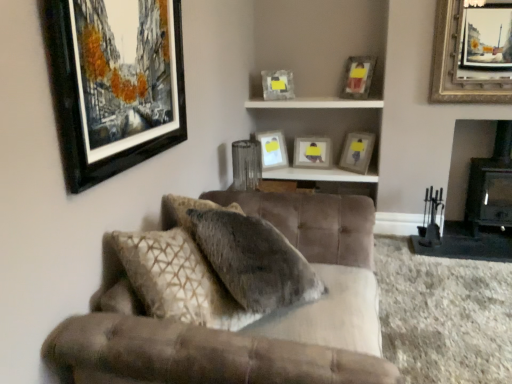
Measure the distance between matte gray picture frame at center, acting as the seventh picture frame starting from the front, and camera.

They are 3.82 meters apart.

Describe the element at coordinates (314, 103) in the screenshot. I see `white glossy shelf at upper center` at that location.

Measure the distance between white glossy shelf at upper center and camera.

The depth of white glossy shelf at upper center is 3.39 meters.

This screenshot has height=384, width=512. Describe the element at coordinates (357, 152) in the screenshot. I see `matte gray picture frame at upper right, which is the 4th picture frame in front-to-back order` at that location.

What do you see at coordinates (234, 309) in the screenshot?
I see `suede couch at center` at bounding box center [234, 309].

The image size is (512, 384). What do you see at coordinates (277, 84) in the screenshot? I see `matte glass picture frame at upper center, marked as the 3th picture frame in a left-to-right arrangement` at bounding box center [277, 84].

At what (x,y) coordinates should I click in order to perform the action: click on matte wooden picture frame at upper right, acting as the third picture frame starting from the front. Please return your answer as a coordinate pair (x, y). This screenshot has width=512, height=384. Looking at the image, I should click on (358, 77).

Measure the distance from matte gray picture frame at center, the 4th picture frame from the left, to black matte picture frame at upper left, arranged as the first picture frame when viewed from the front.

2.27 meters.

Is there a large distance between matte gray picture frame at center, the 4th picture frame from the left, and black matte picture frame at upper left, which is the seventh picture frame in right-to-left order?

Yes, matte gray picture frame at center, the 4th picture frame from the left, and black matte picture frame at upper left, which is the seventh picture frame in right-to-left order, are quite far apart.

What's the angular difference between matte gray picture frame at center, the 4th picture frame from the left, and black matte picture frame at upper left, which is the seventh picture frame in right-to-left order,'s facing directions?

The angle between the facing direction of matte gray picture frame at center, the 4th picture frame from the left, and the facing direction of black matte picture frame at upper left, which is the seventh picture frame in right-to-left order, is 93 degrees.

Between matte gray picture frame at center, the fourth picture frame viewed from the right, and black matte picture frame at upper left, arranged as the first picture frame when viewed from the front, which one has larger size?

black matte picture frame at upper left, arranged as the first picture frame when viewed from the front, is bigger.

Looking at the image, does matte wooden picture frame at upper right, the 3th picture frame in the right-to-left sequence, seem bigger or smaller compared to suede couch at center?

Clearly, matte wooden picture frame at upper right, the 3th picture frame in the right-to-left sequence, is smaller in size than suede couch at center.

Is point (345, 76) positioned after point (274, 350)?

Yes, it is behind point (274, 350).

Is matte wooden picture frame at upper right, acting as the third picture frame starting from the front, not inside suede couch at center?

Yes, matte wooden picture frame at upper right, acting as the third picture frame starting from the front, is located beyond the bounds of suede couch at center.

Considering the positions of objects white glossy shelf at upper center and wooden shelf at upper center in the image provided, who is more to the right, white glossy shelf at upper center or wooden shelf at upper center?

From the viewer's perspective, wooden shelf at upper center appears more on the right side.

From a real-world perspective, does white glossy shelf at upper center sit lower than wooden shelf at upper center?

No, from a real-world perspective, white glossy shelf at upper center is not below wooden shelf at upper center.

Is white glossy shelf at upper center completely or partially outside of wooden shelf at upper center?

Yes, white glossy shelf at upper center is located beyond the bounds of wooden shelf at upper center.

Considering the sizes of white glossy shelf at upper center and wooden shelf at upper center in the image, is white glossy shelf at upper center taller or shorter than wooden shelf at upper center?

Clearly, white glossy shelf at upper center is shorter compared to wooden shelf at upper center.

Is black matte picture frame at upper left, placed as the 1th picture frame when sorted from left to right, located within white glossy shelf at upper center?

Answer: No, black matte picture frame at upper left, placed as the 1th picture frame when sorted from left to right, is not inside white glossy shelf at upper center.

The width and height of the screenshot is (512, 384). In order to click on picture frame that is the 1st object located below the white glossy shelf at upper center (from the image's perspective) in this screenshot , I will do `click(114, 86)`.

Is the position of white glossy shelf at upper center more distant than that of black matte picture frame at upper left, placed as the 1th picture frame when sorted from left to right?

Yes, white glossy shelf at upper center is behind black matte picture frame at upper left, placed as the 1th picture frame when sorted from left to right.

Is white glossy shelf at upper center oriented away from black matte picture frame at upper left, the seventh picture frame viewed from the back?

white glossy shelf at upper center does not have its back to black matte picture frame at upper left, the seventh picture frame viewed from the back.

Measure the distance between white glossy shelf at upper center and matte gray picture frame at center, the fourth picture frame viewed from the right.

white glossy shelf at upper center is 16.83 inches away from matte gray picture frame at center, the fourth picture frame viewed from the right.

Is white glossy shelf at upper center inside or outside of matte gray picture frame at center, acting as the seventh picture frame starting from the front?

white glossy shelf at upper center is not enclosed by matte gray picture frame at center, acting as the seventh picture frame starting from the front.

Looking at this image, which of these two, white glossy shelf at upper center or matte gray picture frame at center, which appears as the 1th picture frame when viewed from the back, is smaller?

With smaller size is white glossy shelf at upper center.

Which object is more forward, suede couch at center or black matte picture frame at upper left, which is the seventh picture frame in right-to-left order?

Positioned in front is suede couch at center.

From the image's perspective, is suede couch at center located beneath black matte picture frame at upper left, the seventh picture frame viewed from the back?

Correct, suede couch at center appears lower than black matte picture frame at upper left, the seventh picture frame viewed from the back, in the image.

Is suede couch at center turned away from black matte picture frame at upper left, the seventh picture frame viewed from the back?

No, black matte picture frame at upper left, the seventh picture frame viewed from the back, is not at the back of suede couch at center.

Consider the image. Would you say suede couch at center is a long distance from black matte picture frame at upper left, arranged as the first picture frame when viewed from the front?

suede couch at center is near black matte picture frame at upper left, arranged as the first picture frame when viewed from the front, not far away.

Identify the location of picture frame that is the 2nd one when counting rightward from the matte gray picture frame at center, the 4th picture frame from the left. (357, 152).

From a real-world perspective, which is physically above, matte gray picture frame at upper right, which is the 4th picture frame in front-to-back order, or matte gray picture frame at center, which appears as the 1th picture frame when viewed from the back?

From a 3D spatial view, matte gray picture frame at upper right, which is the 4th picture frame in front-to-back order, is above.

Based on their sizes in the image, would you say matte gray picture frame at upper right, the 4th picture frame in the back-to-front sequence, is bigger or smaller than matte gray picture frame at center, which appears as the 1th picture frame when viewed from the back?

matte gray picture frame at upper right, the 4th picture frame in the back-to-front sequence, is smaller than matte gray picture frame at center, which appears as the 1th picture frame when viewed from the back.

Starting from the matte gray picture frame at center, acting as the seventh picture frame starting from the front, which picture frame is the 3rd one to the left? Please provide its 2D coordinates.

[(114, 86)]

The height and width of the screenshot is (384, 512). Identify the location of the 4th picture frame counting from the right of the suede couch at center. (358, 77).

From the image, which object appears to be nearer to black matte picture frame at upper left, arranged as the first picture frame when viewed from the front, suede couch at center or matte gray picture frame at upper right, the 6th picture frame viewed from the left?

suede couch at center lies closer to black matte picture frame at upper left, arranged as the first picture frame when viewed from the front, than the other object.

When comparing their distances from gold-framed painting at upper right, the first picture frame positioned from the right, does white glossy shelf at upper center or suede couch at center seem further?

suede couch at center lies further to gold-framed painting at upper right, the first picture frame positioned from the right, than the other object.

From the image, which object appears to be farther from gold-framed painting at upper right, positioned as the second picture frame in front-to-back order, matte gray picture frame at upper right, the 4th picture frame in the back-to-front sequence, or matte white picture frame at upper center, which is the 2th picture frame from back to front?

Among the two, matte white picture frame at upper center, which is the 2th picture frame from back to front, is located further to gold-framed painting at upper right, positioned as the second picture frame in front-to-back order.

Considering their positions, is black matte picture frame at upper left, which is the seventh picture frame in right-to-left order, positioned further to white glossy shelf at upper center than gold-framed painting at upper right, the sixth picture frame positioned from the back?

black matte picture frame at upper left, which is the seventh picture frame in right-to-left order.

Based on their spatial positions, is wooden shelf at upper center or matte white picture frame at upper center, the 2th picture frame viewed from the left, further from matte wooden picture frame at upper right, the 3th picture frame in the right-to-left sequence?

The object further to matte wooden picture frame at upper right, the 3th picture frame in the right-to-left sequence, is matte white picture frame at upper center, the 2th picture frame viewed from the left.

From the image, which object appears to be nearer to matte gray picture frame at upper right, the second picture frame viewed from the right, matte gray picture frame at center, which appears as the 1th picture frame when viewed from the back, or white glossy shelf at upper center?

The object closer to matte gray picture frame at upper right, the second picture frame viewed from the right, is matte gray picture frame at center, which appears as the 1th picture frame when viewed from the back.

Considering their positions, is matte wooden picture frame at upper right, the 3th picture frame in the right-to-left sequence, positioned further to suede couch at center than white glossy shelf at upper center?

Based on the image, matte wooden picture frame at upper right, the 3th picture frame in the right-to-left sequence, appears to be further to suede couch at center.

Based on their spatial positions, is gold-framed painting at upper right, the first picture frame positioned from the right, or matte gray picture frame at center, acting as the seventh picture frame starting from the front, further from matte gray picture frame at upper right, the second picture frame viewed from the right?

Among the two, gold-framed painting at upper right, the first picture frame positioned from the right, is located further to matte gray picture frame at upper right, the second picture frame viewed from the right.

Where is `shelf positioned between suede couch at center and matte glass picture frame at upper center, which is the 3th picture frame from back to front, from near to far`? The height and width of the screenshot is (384, 512). shelf positioned between suede couch at center and matte glass picture frame at upper center, which is the 3th picture frame from back to front, from near to far is located at coordinates (314, 103).

This screenshot has height=384, width=512. I want to click on table between matte glass picture frame at upper center, which is the 3th picture frame from back to front, and gold-framed painting at upper right, the sixth picture frame positioned from the back, from left to right, so click(x=320, y=175).

Find the location of a particular element. The height and width of the screenshot is (384, 512). shelf located between black matte picture frame at upper left, arranged as the first picture frame when viewed from the front, and wooden shelf at upper center in the depth direction is located at coordinates (314, 103).

In order to click on shelf located between matte glass picture frame at upper center, marked as the 3th picture frame in a left-to-right arrangement, and gold-framed painting at upper right, which appears as the 7th picture frame when viewed from the left, in the left-right direction in this screenshot , I will do `click(314, 103)`.